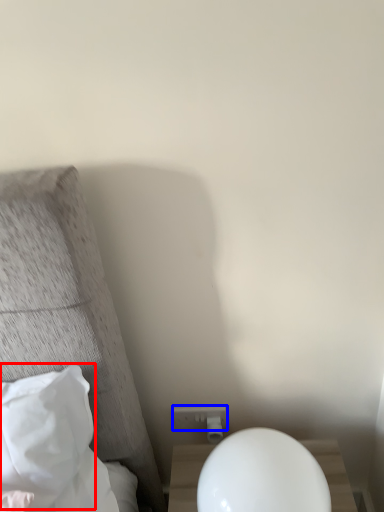
Question: Which object is further to the camera taking this photo, pillow (highlighted by a red box) or electric outlet (highlighted by a blue box)?

Choices:
 (A) pillow
 (B) electric outlet

Answer: (B)